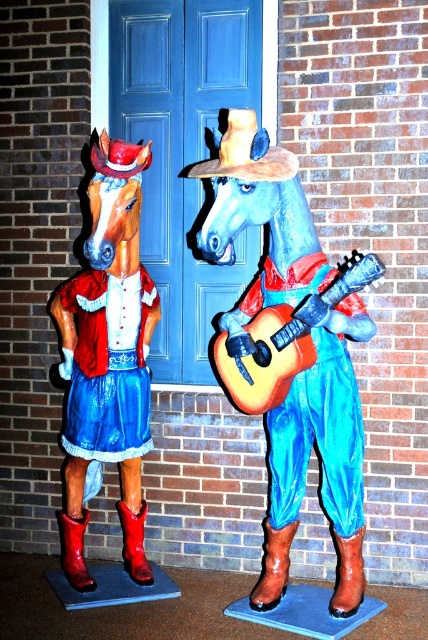
Can you confirm if matte red fabric horse at left is smaller than rubber boot at lower left?

No.

Does matte red fabric horse at left appear on the left side of rubber boot at lower left?

Correct, you'll find matte red fabric horse at left to the left of rubber boot at lower left.

Which is behind, point (115, 285) or point (127, 572)?

Positioned behind is point (127, 572).

This screenshot has width=428, height=640. I want to click on matte red fabric horse at left, so click(x=107, y=356).

Does brown leather boot at lower right appear over rubber matte boot at lower right?

No.

Does brown leather boot at lower right have a lesser height compared to rubber matte boot at lower right?

In fact, brown leather boot at lower right may be taller than rubber matte boot at lower right.

Is point (261, 563) more distant than point (356, 579)?

That is True.

This screenshot has width=428, height=640. I want to click on brown leather boot at lower right, so click(x=273, y=566).

Who is positioned more to the left, matte blue horse at center or red matte boot at lower left?

red matte boot at lower left is more to the left.

This screenshot has height=640, width=428. What do you see at coordinates (288, 324) in the screenshot?
I see `matte blue horse at center` at bounding box center [288, 324].

At what (x,y) coordinates should I click in order to perform the action: click on matte blue horse at center. Please return your answer as a coordinate pair (x, y). This screenshot has height=640, width=428. Looking at the image, I should click on (288, 324).